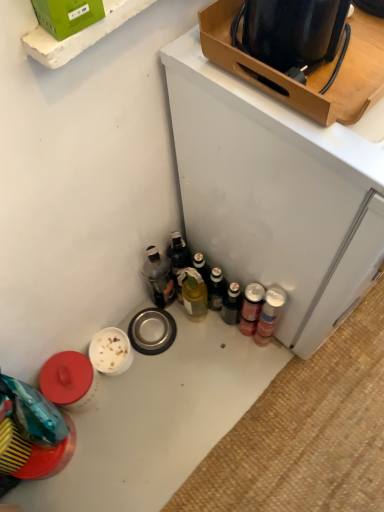
This screenshot has width=384, height=512. Find the location of `free spot to the left of metallic silver can at lower right`. free spot to the left of metallic silver can at lower right is located at coordinates (203, 348).